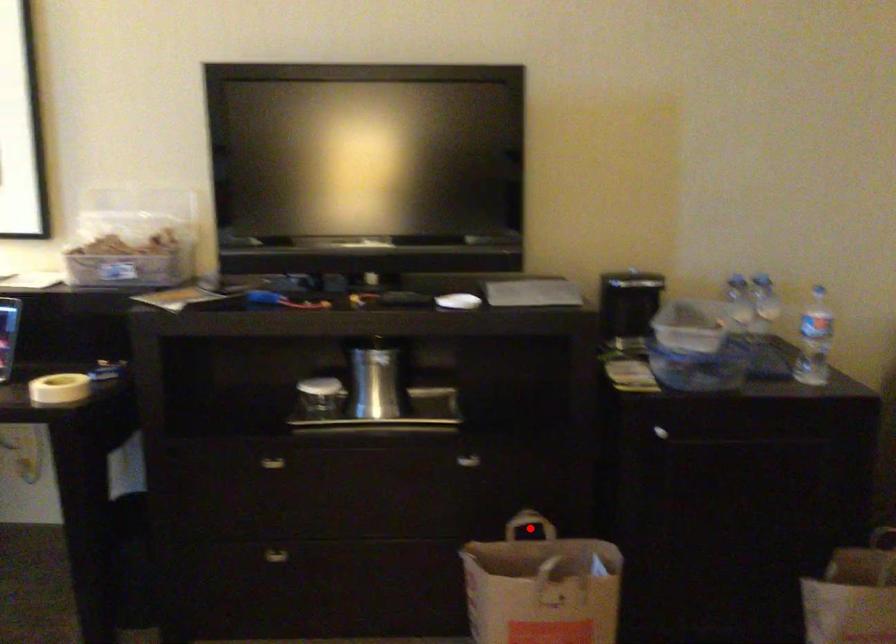
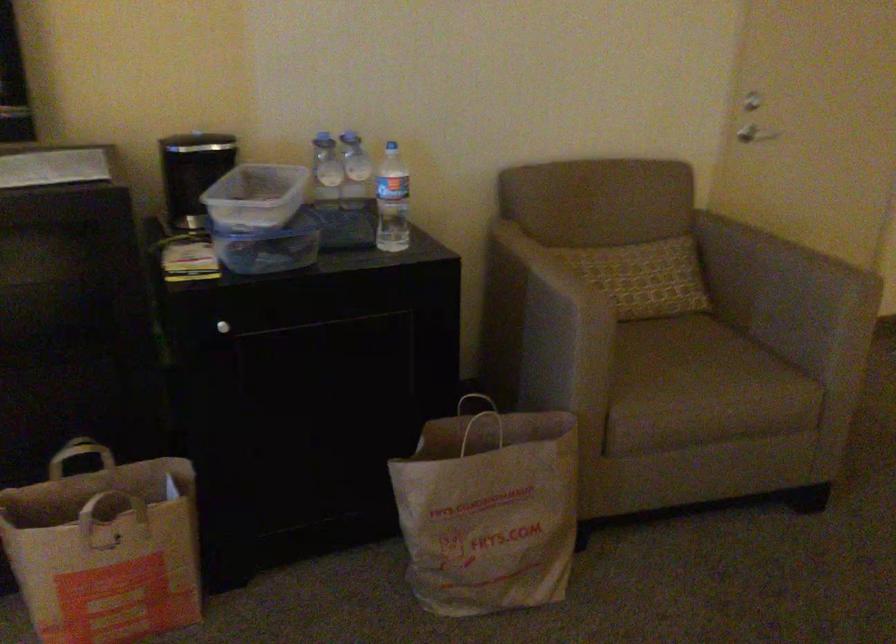
Find the pixel in the second image that matches the highlighted location in the first image.

(82, 458)